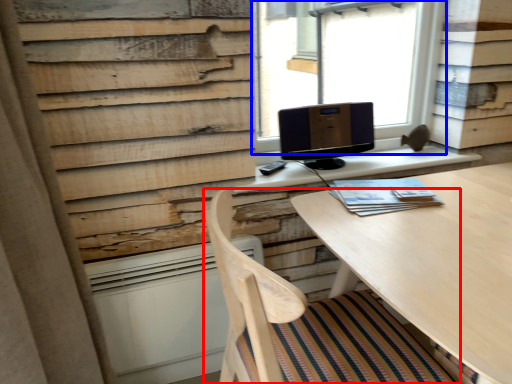
Question: Among these objects, which one is farthest to the camera, chair (highlighted by a red box) or window (highlighted by a blue box)?

Choices:
 (A) chair
 (B) window

Answer: (B)